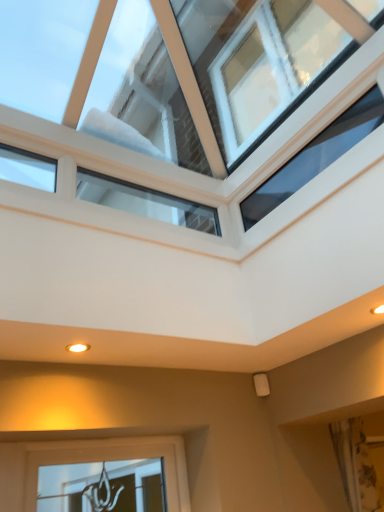
The image size is (384, 512). What do you see at coordinates (106, 88) in the screenshot? I see `transparent glass window at upper center` at bounding box center [106, 88].

What are the coordinates of `transparent glass window at upper center` in the screenshot? It's located at (106, 88).

Measure the distance between point (x=164, y=51) and camera.

A distance of 9.70 feet exists between point (x=164, y=51) and camera.

Where is `transparent glass window at upper center`? The height and width of the screenshot is (512, 384). transparent glass window at upper center is located at coordinates (106, 88).